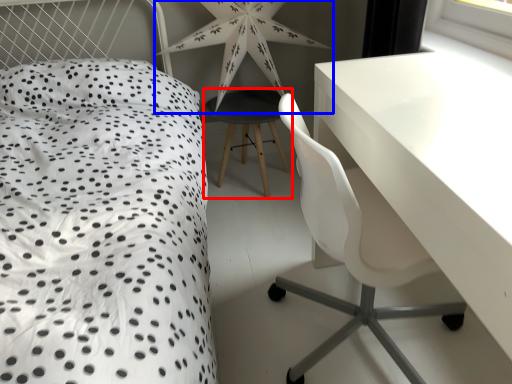
Question: Which object is further to the camera taking this photo, bar stool (highlighted by a red box) or star (highlighted by a blue box)?

Choices:
 (A) bar stool
 (B) star

Answer: (A)